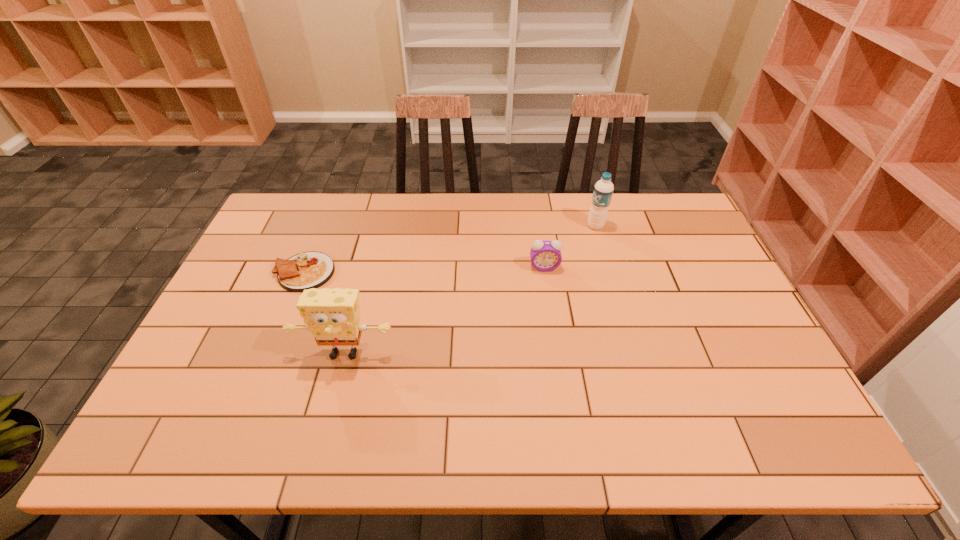
Where is `vacant space situated on the face of the alarm clock`? The image size is (960, 540). vacant space situated on the face of the alarm clock is located at coordinates (557, 351).

Image resolution: width=960 pixels, height=540 pixels. In order to click on vacant space located 0.260m on the right of the omelet in this screenshot , I will do `click(420, 272)`.

Where is `object located at the far edge`? object located at the far edge is located at coordinates (603, 190).

Image resolution: width=960 pixels, height=540 pixels. Find the location of `object located in the left edge section of the desktop`. object located in the left edge section of the desktop is located at coordinates (306, 270).

Image resolution: width=960 pixels, height=540 pixels. I want to click on free spot at the far edge of the desktop, so click(x=338, y=232).

What are the coordinates of `free space at the left edge` in the screenshot? It's located at click(x=256, y=350).

Find the location of a particular element. Image resolution: width=960 pixels, height=540 pixels. vacant space at the right edge of the desktop is located at coordinates (722, 396).

Image resolution: width=960 pixels, height=540 pixels. Find the location of `vacant space at the far left corner`. vacant space at the far left corner is located at coordinates (274, 236).

This screenshot has height=540, width=960. In order to click on free point between the alarm clock and the shortest object in this screenshot , I will do `click(424, 270)`.

The height and width of the screenshot is (540, 960). I want to click on free space between the shortest object and the farthest object, so click(x=450, y=249).